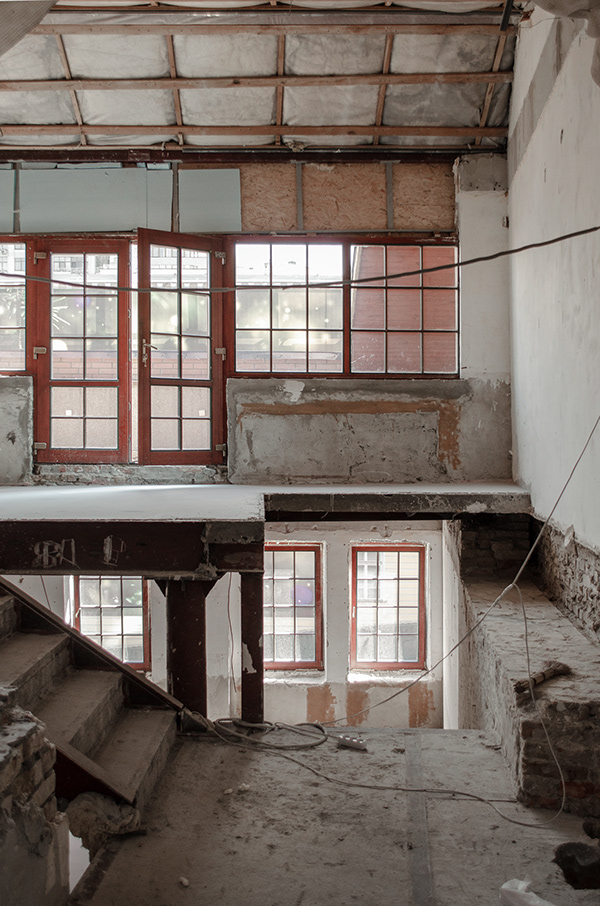
At what (x,y) coordinates should I click in order to perform the action: click on hinges of door. Please return your answer as a coordinate pair (x, y). Looking at the image, I should click on (36, 349), (39, 444), (36, 255), (219, 446), (219, 348), (218, 252).